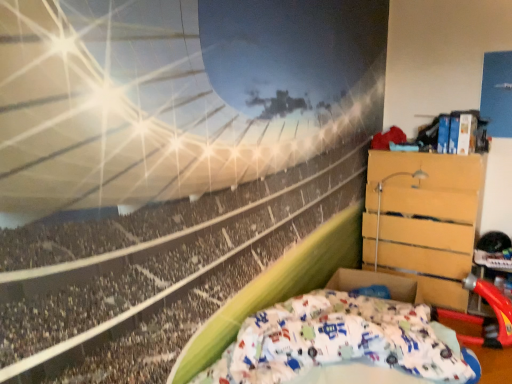
Question: In terms of height, does white cotton bed at lower right look taller or shorter compared to wooden chest of drawers at right?

Choices:
 (A) tall
 (B) short

Answer: (B)

Question: Based on their positions, is white cotton bed at lower right located to the left or right of wooden chest of drawers at right?

Choices:
 (A) right
 (B) left

Answer: (B)

Question: Considering the positions of white cotton bed at lower right and wooden chest of drawers at right in the image, is white cotton bed at lower right wider or thinner than wooden chest of drawers at right?

Choices:
 (A) wide
 (B) thin

Answer: (A)

Question: Is wooden chest of drawers at right bigger or smaller than white cotton bed at lower right?

Choices:
 (A) big
 (B) small

Answer: (A)

Question: Does point (411, 210) appear closer or farther from the camera than point (307, 299)?

Choices:
 (A) farther
 (B) closer

Answer: (A)

Question: From a real-world perspective, is wooden chest of drawers at right above or below white cotton bed at lower right?

Choices:
 (A) below
 (B) above

Answer: (B)

Question: From the image's perspective, is wooden chest of drawers at right located above or below white cotton bed at lower right?

Choices:
 (A) above
 (B) below

Answer: (A)